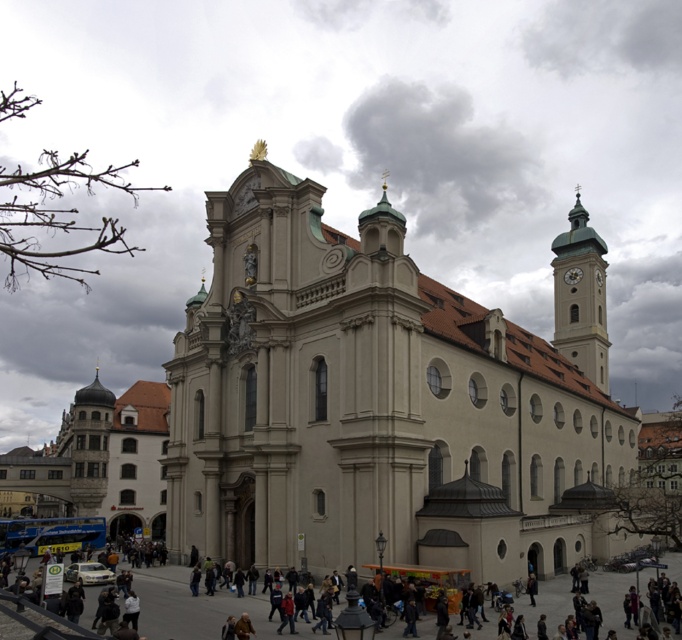
You are standing in the square in front of the historic church and want to walk to the point marked as point (192, 436) and point (567, 280). Which point should you reach first if you want to follow the shortest path from your current position?

You should reach point (192, 436) first because it is closer to you than point (567, 280), so the shortest path would lead you there first.